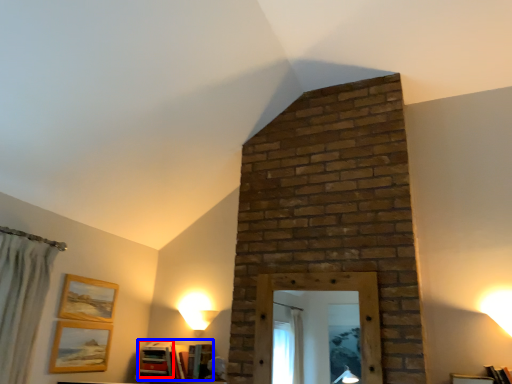
Question: Which point is further to the camera, book (highlighted by a red box) or book (highlighted by a blue box)?

Choices:
 (A) book
 (B) book

Answer: (A)